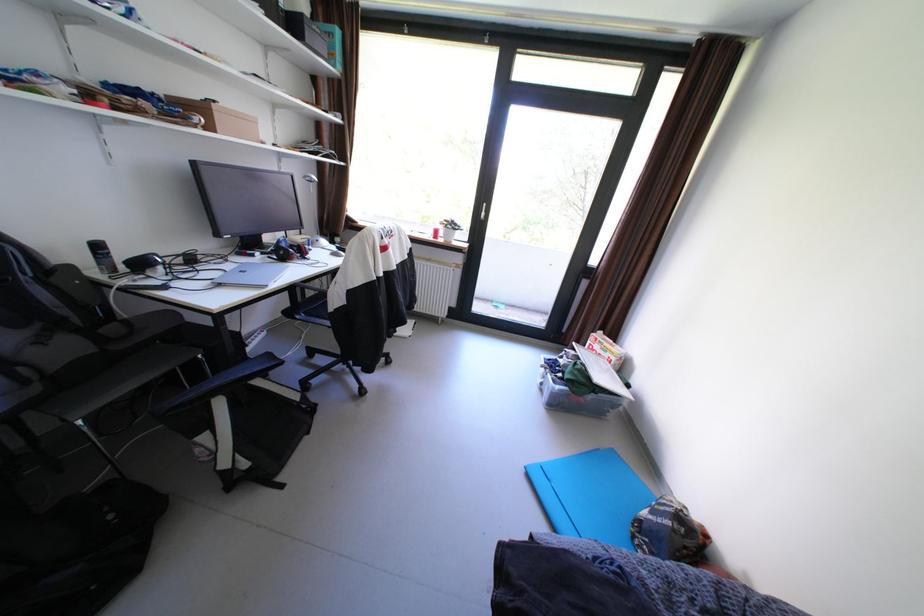
What do you see at coordinates (225, 361) in the screenshot?
I see `the black chair armrest` at bounding box center [225, 361].